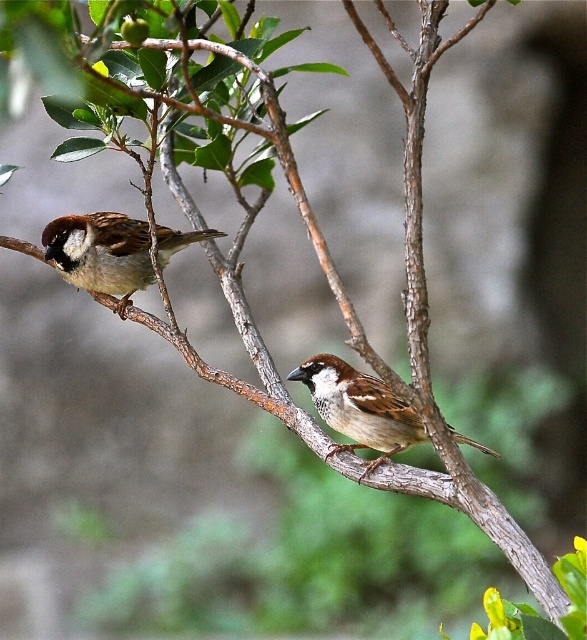
Is point (130, 237) positioned before point (396, 408)?

No, (130, 237) is further to viewer.

In the scene shown: Can you confirm if brown matte sparrow at left is smaller than brown feathered sparrow at center?

No, brown matte sparrow at left is not smaller than brown feathered sparrow at center.

Is point (131, 273) in front of point (390, 428)?

No.

Locate an element on the screen. The image size is (587, 640). brown matte sparrow at left is located at coordinates (102, 253).